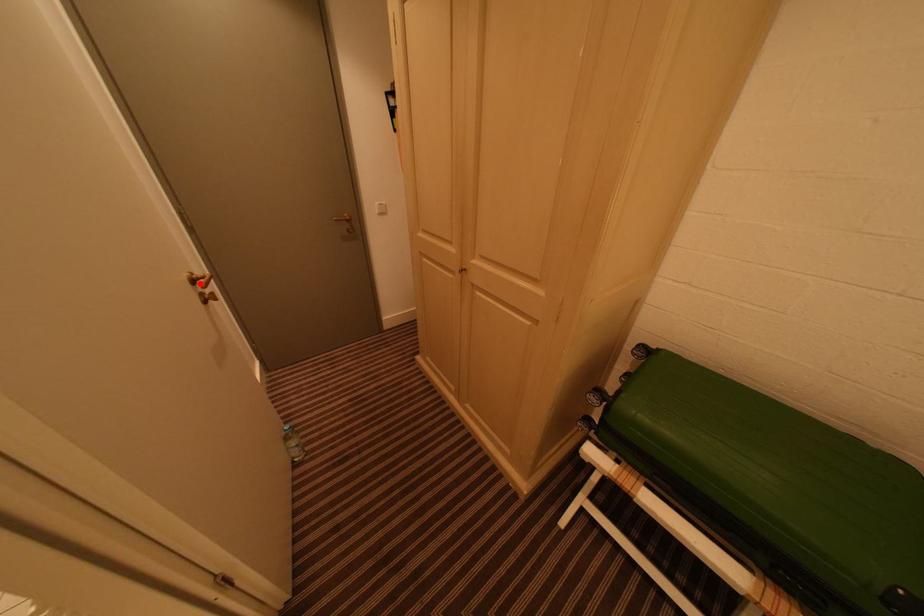
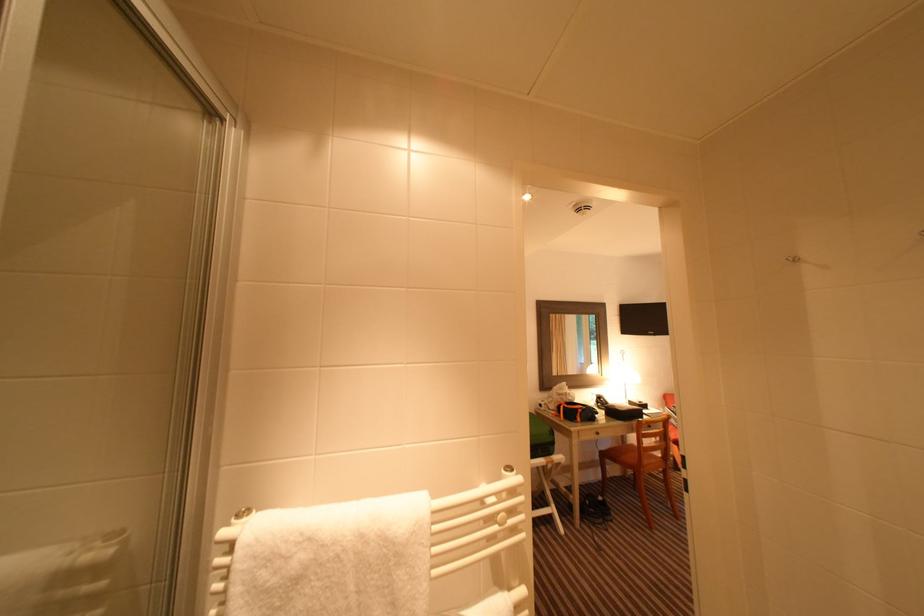
Question: I am providing you with two images of the same scene from different viewpoints. A red point is marked on the first image. Is the red point's position out of view in image 2?

Choices:
 (A) Yes
 (B) No

Answer: (A)